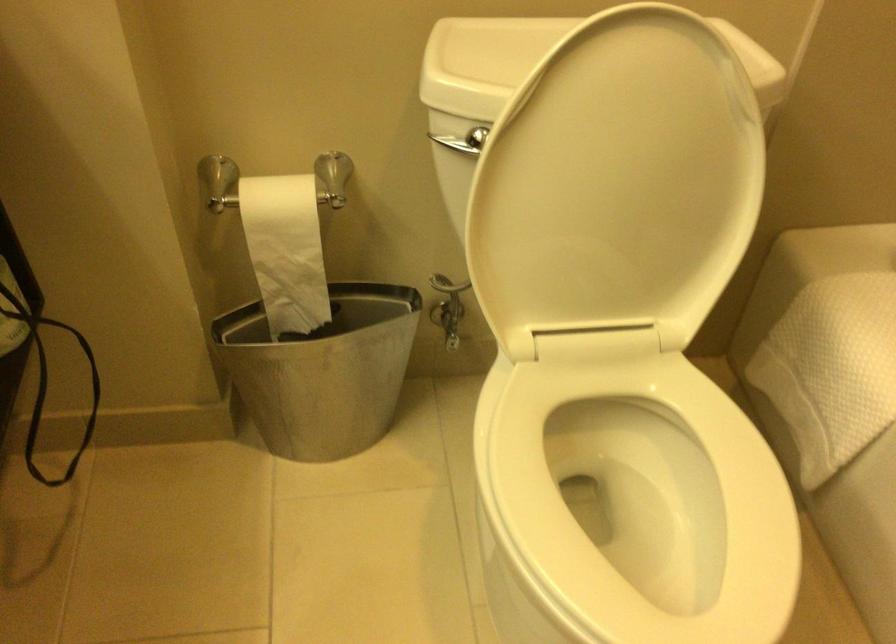
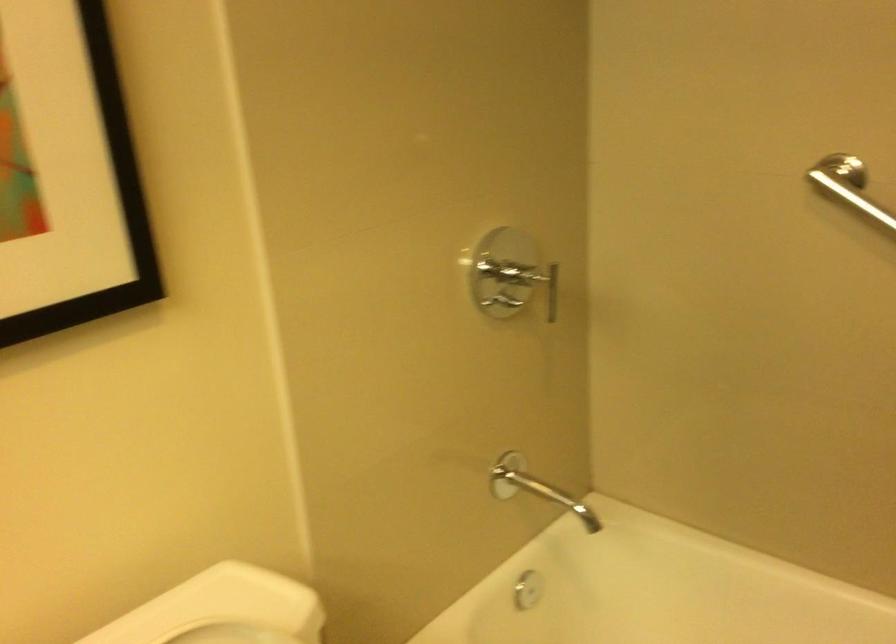
Question: The first image is from the beginning of the video and the second image is from the end. How did the camera likely rotate when shooting the video?

Choices:
 (A) Left
 (B) Right
 (C) Up
 (D) Down

Answer: (B)